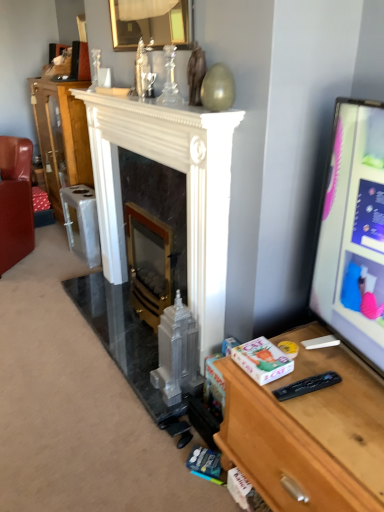
Image resolution: width=384 pixels, height=512 pixels. Identify the location of free space above wooden desk at right (from a real-world perspective). (334, 394).